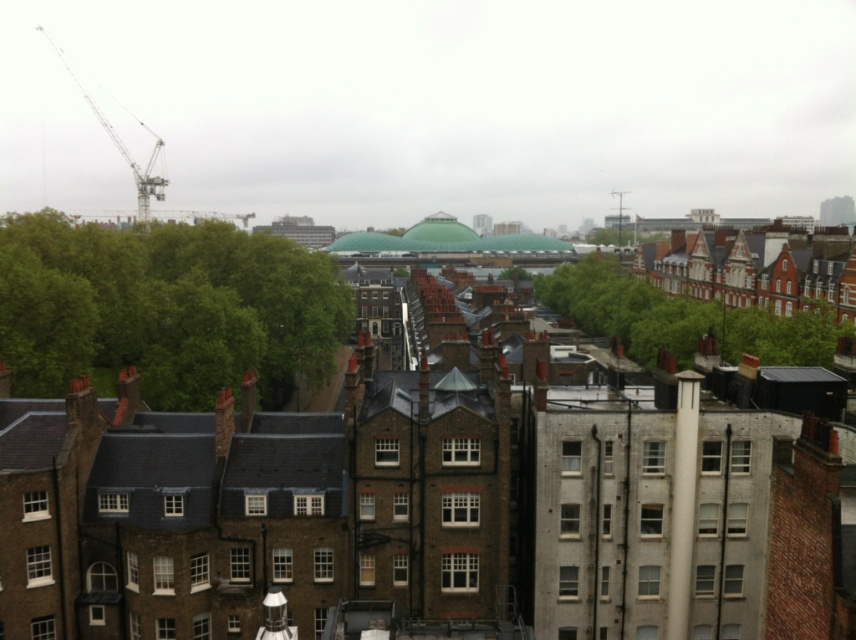
Question: Considering the real-world distances, which object is closest to the green leafy tree at left?

Choices:
 (A) green leafy tree at center
 (B) metallic silver crane at upper left

Answer: (A)

Question: Where is green leafy tree at left located in relation to metallic silver crane at upper left in the image?

Choices:
 (A) below
 (B) above

Answer: (A)

Question: Is green leafy tree at center below metallic silver crane at upper left?

Choices:
 (A) no
 (B) yes

Answer: (B)

Question: Which object appears closest to the camera in this image?

Choices:
 (A) green leafy tree at center
 (B) green leafy tree at left

Answer: (B)

Question: Estimate the real-world distances between objects in this image. Which object is farther from the green leafy tree at left?

Choices:
 (A) metallic silver crane at upper left
 (B) green leafy tree at center

Answer: (A)

Question: Does green leafy tree at center lie in front of metallic silver crane at upper left?

Choices:
 (A) yes
 (B) no

Answer: (A)